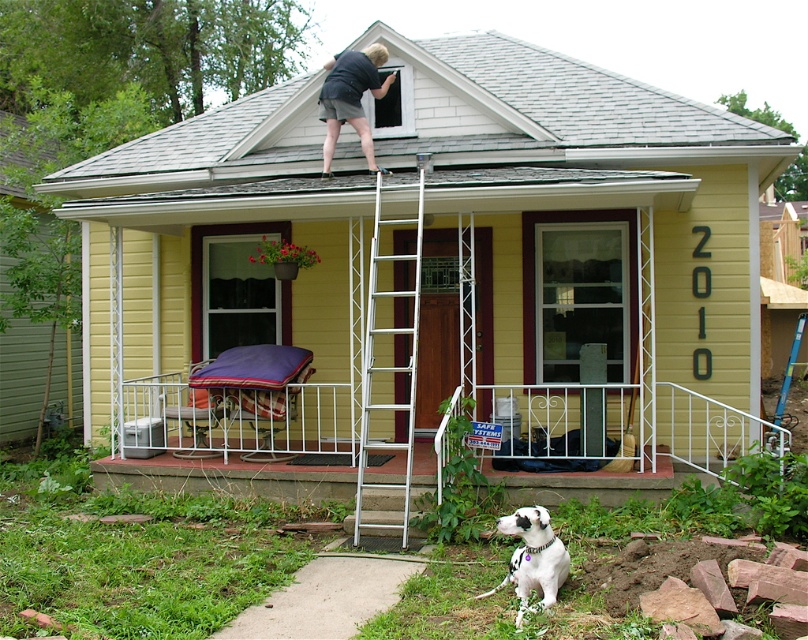
Question: Considering the real-world distances, which object is farthest from the white-spotted fur dog at lower right?

Choices:
 (A) white metal railing at lower center
 (B) white metallic ladder at upper center
 (C) dark blue shirt at upper center

Answer: (C)

Question: Does white metal railing at lower center have a lesser width compared to dark blue shirt at upper center?

Choices:
 (A) yes
 (B) no

Answer: (B)

Question: In this image, where is dark blue shirt at upper center located relative to white-spotted fur dog at lower right?

Choices:
 (A) below
 (B) above

Answer: (B)

Question: Which point is closer to the camera?

Choices:
 (A) coord(379,60)
 (B) coord(404,353)
 (C) coord(707,435)
 (D) coord(486,593)

Answer: (D)

Question: Among these points, which one is farthest from the camera?

Choices:
 (A) (549, 557)
 (B) (150, 387)

Answer: (B)

Question: Is white metal railing at lower center smaller than dark blue shirt at upper center?

Choices:
 (A) no
 (B) yes

Answer: (B)